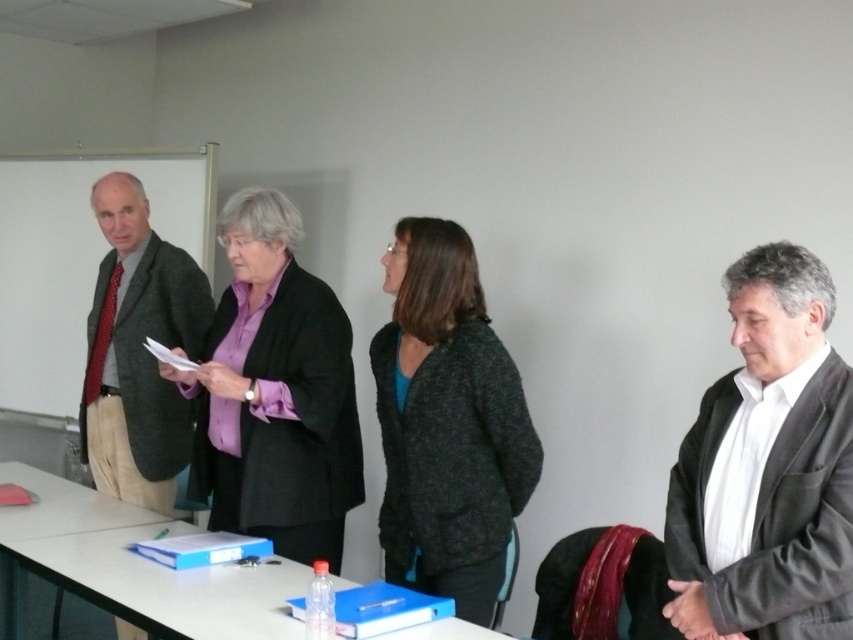
Does point (325, 381) come closer to viewer compared to point (204, 296)?

Yes, point (325, 381) is in front of point (204, 296).

Can you confirm if purple matte shirt at center is taller than matte gray blazer at left?

Incorrect, purple matte shirt at center's height is not larger of matte gray blazer at left's.

Does point (291, 419) come closer to viewer compared to point (86, 353)?

Yes, it is.

I want to click on purple matte shirt at center, so click(x=276, y=392).

Can you confirm if dark gray suit at right is positioned to the right of dark gray woolen sweater at center?

Yes, dark gray suit at right is to the right of dark gray woolen sweater at center.

Who is shorter, dark gray suit at right or dark gray woolen sweater at center?

dark gray suit at right

Locate an element on the screen. The height and width of the screenshot is (640, 853). dark gray suit at right is located at coordinates (767, 467).

Where is `dark gray suit at right`? The width and height of the screenshot is (853, 640). dark gray suit at right is located at coordinates (767, 467).

Describe the element at coordinates (447, 422) in the screenshot. The image size is (853, 640). I see `dark gray woolen sweater at center` at that location.

Is dark gray woolen sweater at center smaller than matte gray blazer at left?

Correct, dark gray woolen sweater at center occupies less space than matte gray blazer at left.

Where is `dark gray woolen sweater at center`? The image size is (853, 640). dark gray woolen sweater at center is located at coordinates (447, 422).